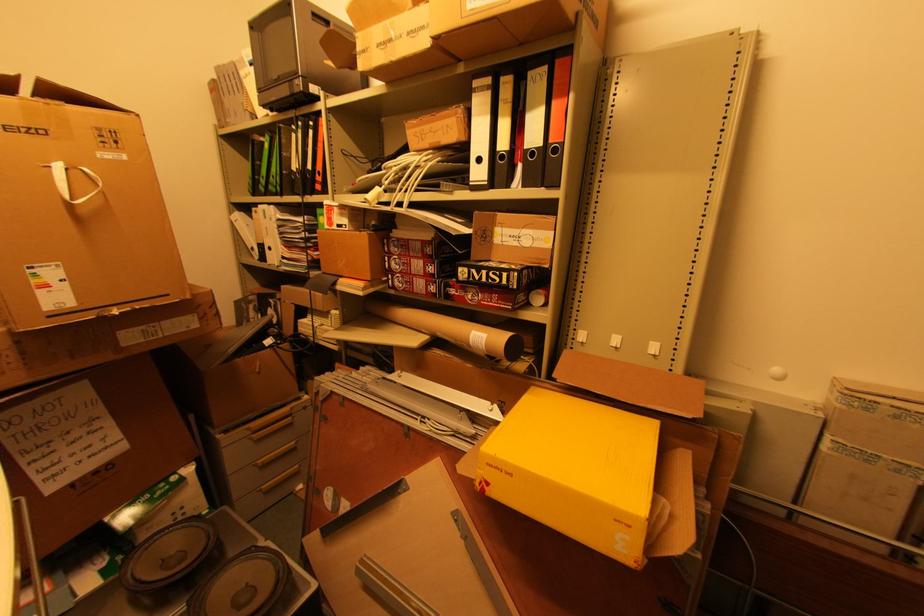
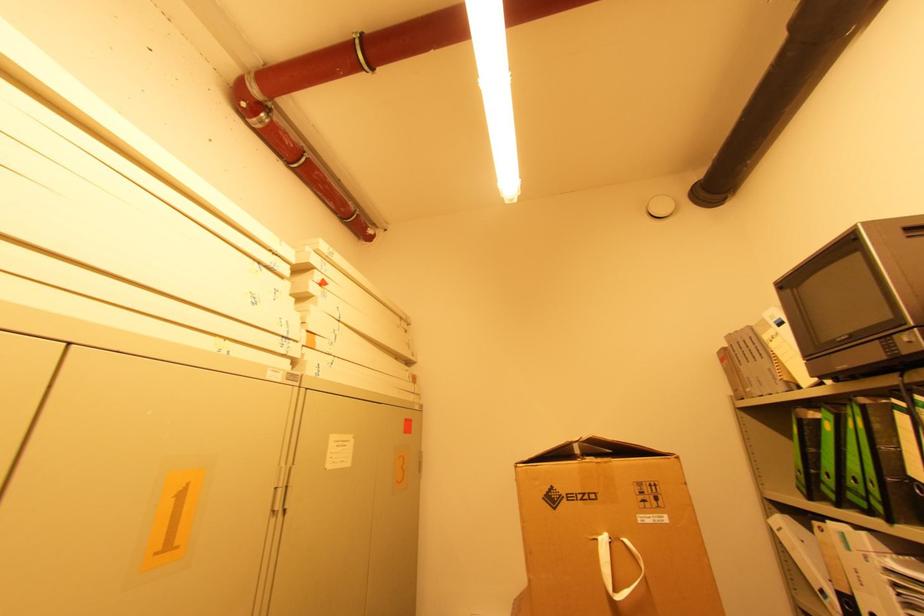
In the second image, find the point that corresponds to the point at 63,166 in the first image.

(608, 541)